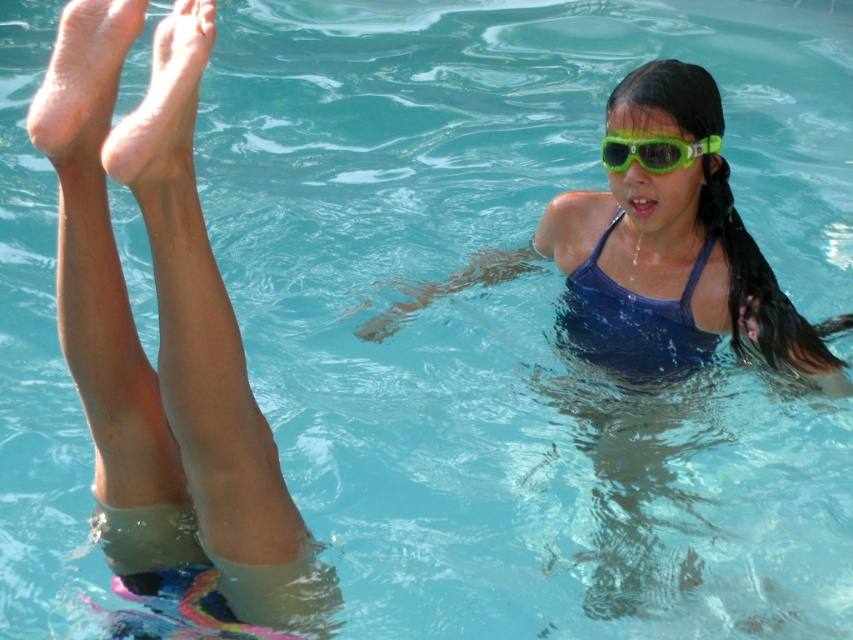
Is smooth skin legs at upper left taller than blue fabric swimsuit at center?

Yes, smooth skin legs at upper left is taller than blue fabric swimsuit at center.

Between smooth skin legs at upper left and blue fabric swimsuit at center, which one appears on the right side from the viewer's perspective?

blue fabric swimsuit at center is more to the right.

What do you see at coordinates (165, 342) in the screenshot? I see `smooth skin legs at upper left` at bounding box center [165, 342].

The height and width of the screenshot is (640, 853). I want to click on smooth skin legs at upper left, so click(x=165, y=342).

Measure the distance between pale skin feet at upper left and green matte goggles at upper center.

6.51 feet

Between point (170, 52) and point (717, 148), which one is positioned behind?

Positioned behind is point (717, 148).

Between point (189, 33) and point (646, 164), which one is positioned in front?

Point (189, 33) is more forward.

Image resolution: width=853 pixels, height=640 pixels. I want to click on pale skin feet at upper left, so click(164, 106).

Between point (604, 276) and point (64, 163), which one is positioned behind?

Positioned behind is point (604, 276).

At what (x,y) coordinates should I click in order to perform the action: click on blue fabric swimsuit at center. Please return your answer as a coordinate pair (x, y). Image resolution: width=853 pixels, height=640 pixels. Looking at the image, I should click on (631, 321).

Which is behind, point (611, 342) or point (59, 141)?

The point (611, 342) is behind.

Identify the location of blue fabric swimsuit at center. (631, 321).